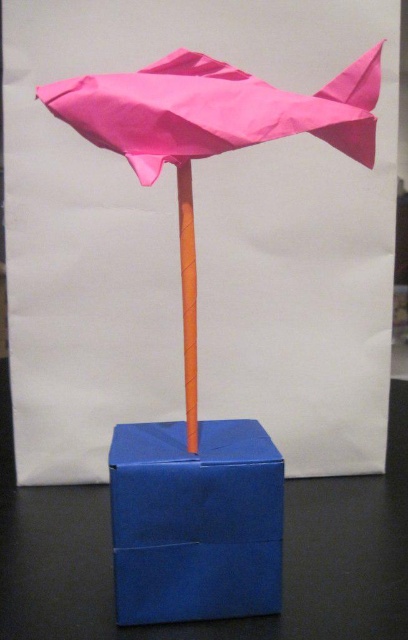
You are an art installer who needs to place a protective cover over the pink paper fish at upper center and the orange matte stick at center. The cover must be wide enough to fully enclose both objects. Based on their widths, which object requires the cover to be wider?

The pink paper fish at upper center might be wider than orange matte stick at center, so the cover needs to be wide enough to accommodate the width of the pink paper fish at upper center.

You are an artist trying to place a small decoration on the pink paper umbrella at center. The coordinates of the umbrella are given as point 0.173, 0.522. If you want to place the decoration exactly at the center of the umbrella, where should you position it?

The pink paper umbrella at center is located at point (212, 109), so you should position the decoration at the center coordinates of the umbrella, which would be the same point (212, 109).

You are holding a measuring tool that can only measure distances up to 1 meter. You need to measure the distance from your current position to the point at coordinates point (148, 136). Can your tool measure this distance?

The distance of point (148, 136) is 96.85 centimeters from the viewer, so yes, the measuring tool can measure this distance since it is within the 1 meter limit.